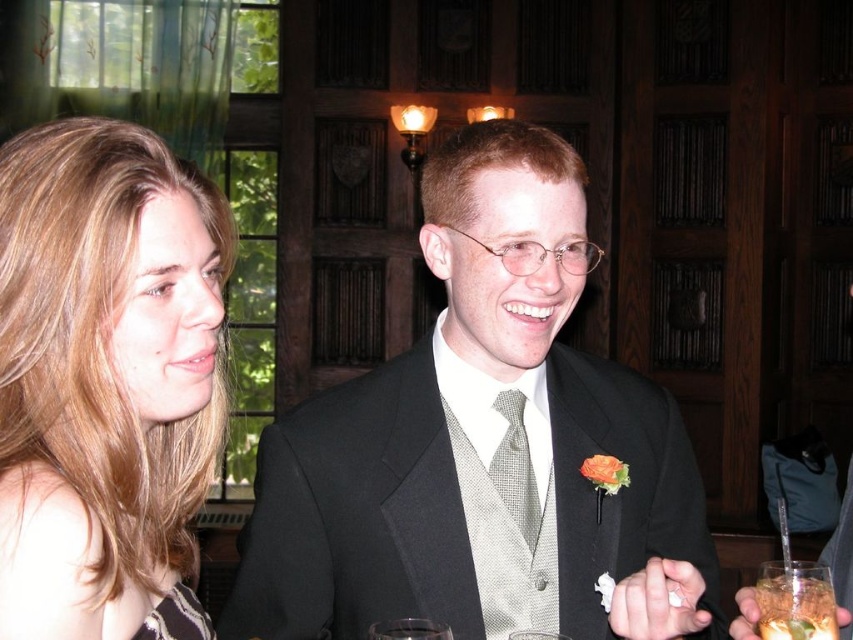
Question: Estimate the real-world distances between objects in this image. Which object is closer to the black textured dress at lower left?

Choices:
 (A) matte black suit at center
 (B) gray textured tie at center
 (C) translucent glass beverage at lower right

Answer: (B)

Question: Which point appears farthest from the camera in this image?

Choices:
 (A) (514, 394)
 (B) (160, 625)
 (C) (57, 550)

Answer: (A)

Question: Where is blonde hair at left located in relation to translucent glass beverage at lower right in the image?

Choices:
 (A) above
 (B) below

Answer: (A)

Question: Is translucent glass beverage at lower right bigger than black textured dress at lower left?

Choices:
 (A) no
 (B) yes

Answer: (A)

Question: Can you confirm if matte black suit at center is wider than blonde hair at left?

Choices:
 (A) yes
 (B) no

Answer: (A)

Question: Which is farther from the translucent glass beverage at lower right?

Choices:
 (A) gray textured tie at center
 (B) blonde hair at left

Answer: (B)